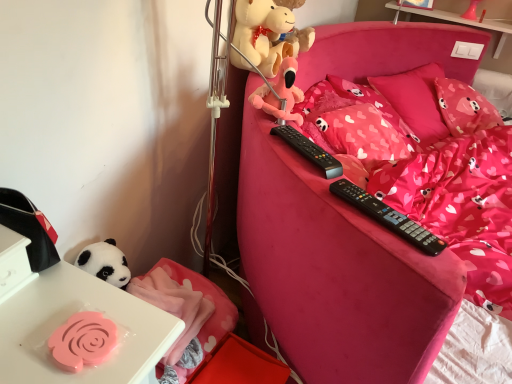
Question: Does point (178, 301) appear closer or farther from the camera than point (271, 160)?

Choices:
 (A) closer
 (B) farther

Answer: (B)

Question: Would you say pink fabric blanket at lower left is inside or outside pink fabric bed at center?

Choices:
 (A) inside
 (B) outside

Answer: (B)

Question: Which is nearer to the pink fabric pillow at upper right, which is the 2th pillow from right to left?

Choices:
 (A) pink fabric pillow at upper right, the second pillow positioned from the left
 (B) white glossy table at upper right
 (C) black plastic remote control at center, acting as the first remote control starting from the back
 (D) pink fabric bedding at center
 (E) black plastic remote control at upper right, acting as the 1th remote control starting from the front

Answer: (A)

Question: Which of these objects is positioned farthest from the pink fabric bed at center?

Choices:
 (A) pink fabric blanket at lower left
 (B) black plastic remote control at center, acting as the first remote control starting from the back
 (C) pink fabric pillow at upper right, which is the 2th pillow from right to left
 (D) pink fabric pillow at upper right, the second pillow positioned from the left
 (E) white glossy table at upper right

Answer: (E)